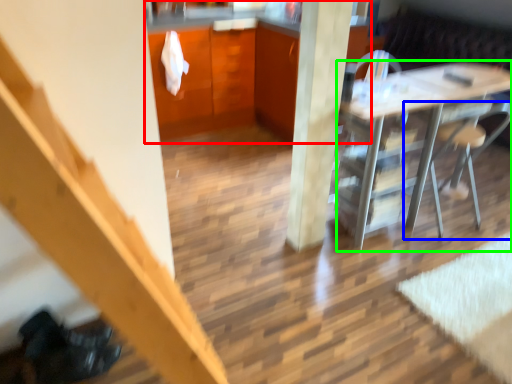
Question: Which object is positioned farthest from cabinetry (highlighted by a red box)? Select from chair (highlighted by a blue box) and desk (highlighted by a green box).

Choices:
 (A) chair
 (B) desk

Answer: (A)